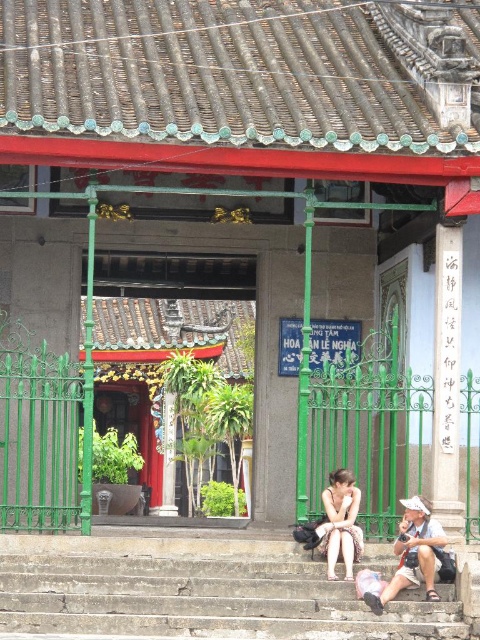
You are standing at the entrance of the traditional building and see the concrete stairs at lower center and the white cotton dress at center. Which object is closer to you?

The concrete stairs at lower center is closer to you because it is in front of the white cotton dress at center.

You are a photographer standing at the entrance of the traditional building. You want to take a photo of both the matte white shirt at lower center and the white cotton dress at center. Can you fit both items in the frame if your camera has a 1.5 meter wide field of view?

The matte white shirt at lower center and white cotton dress at center are 1.06 meters apart. Since the distance between them is less than the camera field of view of 1.5 meters, both items can be captured in the frame.